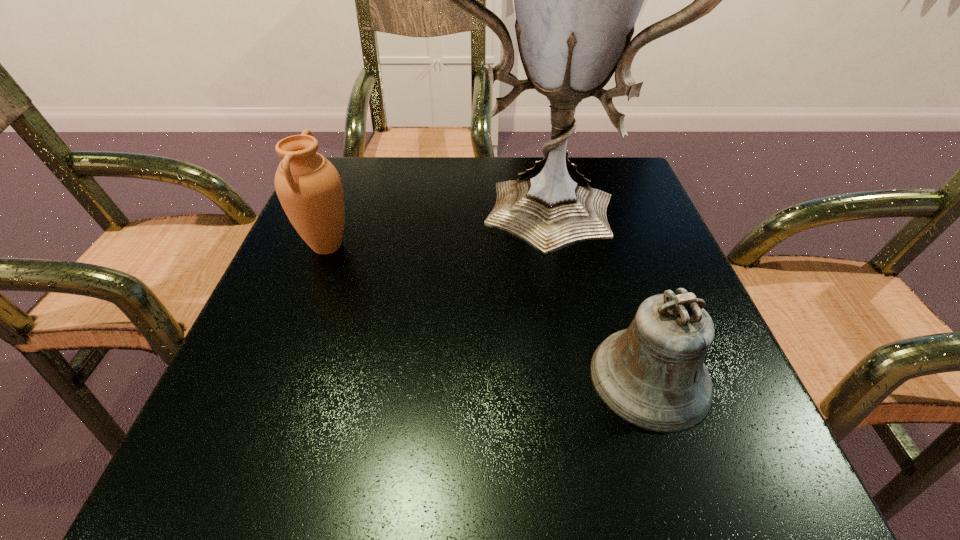
Locate an element on the screen. Image resolution: width=960 pixels, height=540 pixels. object that is positioned at the left edge is located at coordinates (309, 188).

Find the location of a particular element. Image resolution: width=960 pixels, height=540 pixels. trophy cup that is at the right edge is located at coordinates (577, 0).

Find the location of `bell located at the right edge`. bell located at the right edge is located at coordinates (652, 375).

Image resolution: width=960 pixels, height=540 pixels. Find the location of `object located at the far right corner`. object located at the far right corner is located at coordinates (577, 0).

Locate an element on the screen. The width and height of the screenshot is (960, 540). object at the near right corner is located at coordinates (652, 375).

I want to click on vacant region at the far edge of the desktop, so click(x=420, y=194).

The height and width of the screenshot is (540, 960). In the image, there is a desktop. Find the location of `vacant space at the near edge`. vacant space at the near edge is located at coordinates (347, 472).

You are a GUI agent. You are given a task and a screenshot of the screen. Output one action in this format:
    pyautogui.click(x=<x>, y=<y>)
    Task: Click on the vacant space at the left edge of the desktop
    
    Given the screenshot: What is the action you would take?
    pyautogui.click(x=311, y=290)

Where is `vacant space at the right edge of the desktop`? Image resolution: width=960 pixels, height=540 pixels. vacant space at the right edge of the desktop is located at coordinates (650, 231).

You are a GUI agent. You are given a task and a screenshot of the screen. Output one action in this format:
    pyautogui.click(x=<x>, y=<y>)
    Task: Click on the free spot at the far left corner of the desktop
    This screenshot has width=960, height=540.
    Given the screenshot: What is the action you would take?
    pyautogui.click(x=343, y=168)